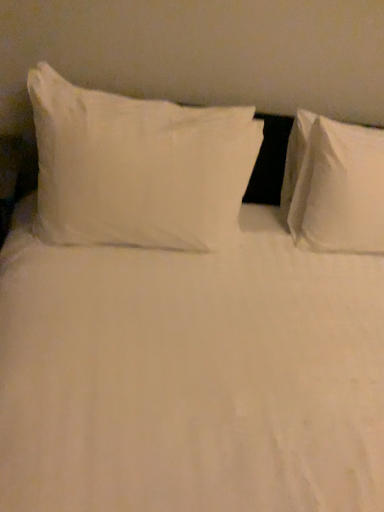
Identify the location of white cotton pillow at upper left. (138, 167).

Describe the element at coordinates (138, 167) in the screenshot. I see `white cotton pillow at upper left` at that location.

What is the approximate height of white cotton pillow at upper left?

white cotton pillow at upper left is 21.18 inches tall.

Identify the location of white cotton pillow at upper left. (138, 167).